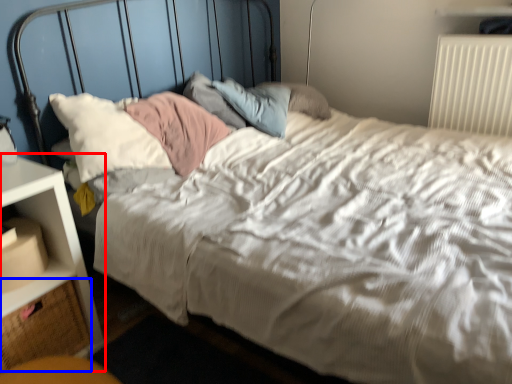
Question: Which object appears farthest to the camera in this image, nightstand (highlighted by a red box) or drawer (highlighted by a blue box)?

Choices:
 (A) nightstand
 (B) drawer

Answer: (B)